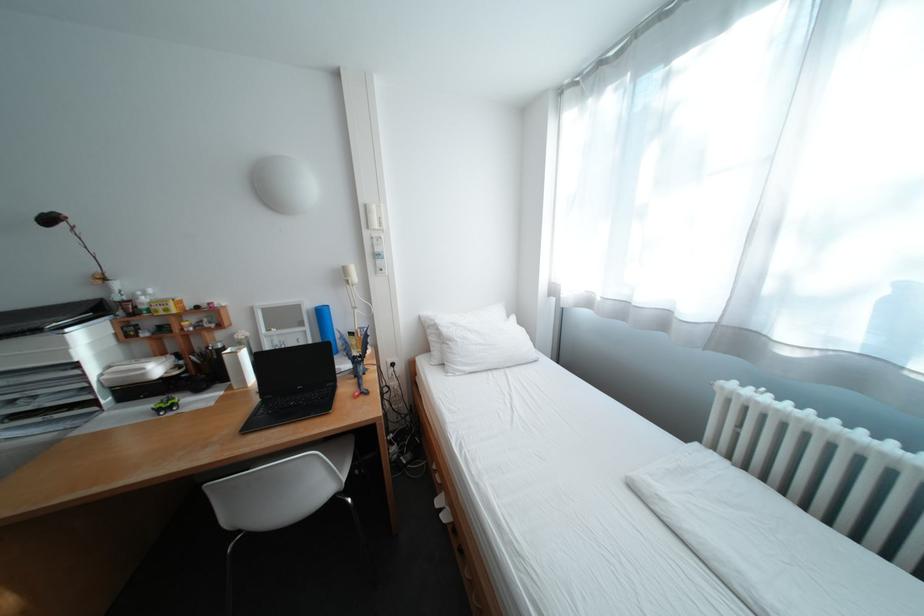
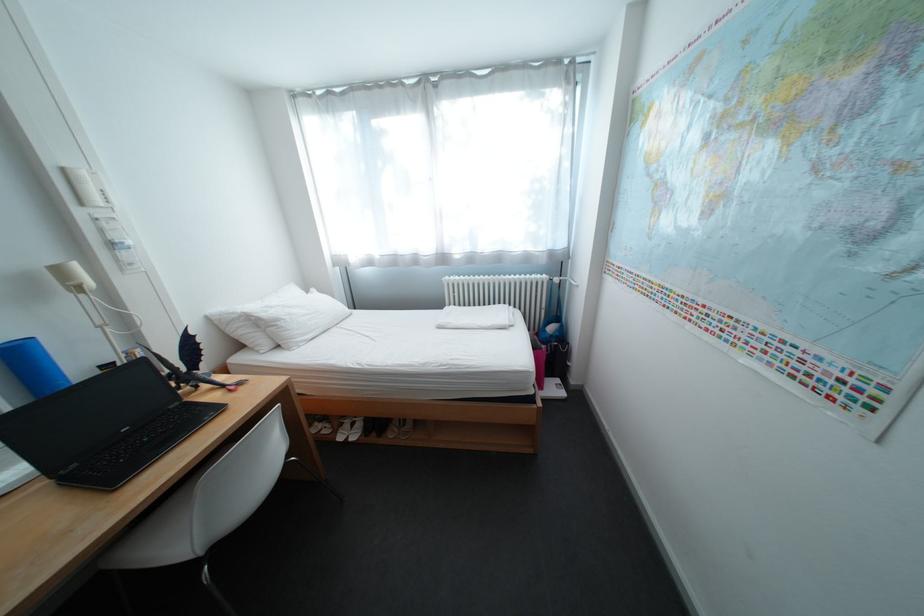
The point at [748,384] is marked in the first image. Where is the corresponding point in the second image?

(459, 278)